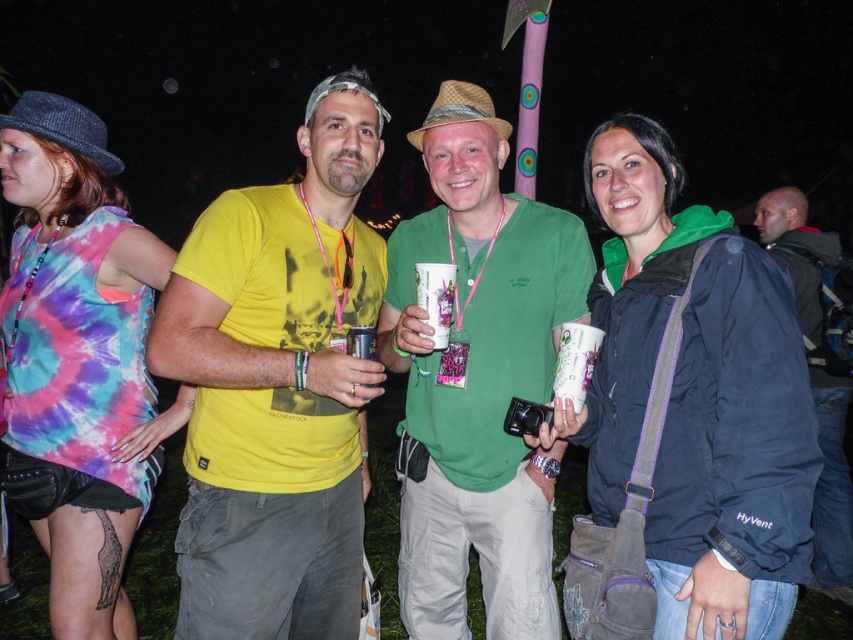
You are a photographer at the festival and want to ensure all participants are visible in the photo. Since the green matte shirt at center and dark blue jacket at right are in the frame, which one might be partially hidden if you adjust the camera angle downward?

The green matte shirt at center is not as tall as dark blue jacket at right, so adjusting the camera angle downward might hide the shorter green matte shirt at center first.